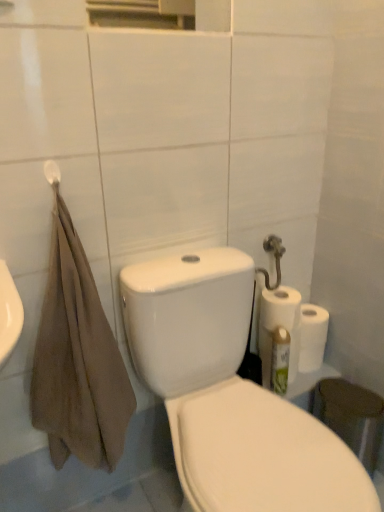
Question: Is white matte towel bar at upper left facing towards white glossy porcelain at center?

Choices:
 (A) no
 (B) yes

Answer: (A)

Question: Is white matte towel bar at upper left closer to the viewer compared to white glossy porcelain at center?

Choices:
 (A) yes
 (B) no

Answer: (B)

Question: Considering the relative positions of white matte towel bar at upper left and white glossy porcelain at center in the image provided, is white matte towel bar at upper left to the left of white glossy porcelain at center from the viewer's perspective?

Choices:
 (A) no
 (B) yes

Answer: (B)

Question: From a real-world perspective, is white matte towel bar at upper left over white glossy porcelain at center?

Choices:
 (A) yes
 (B) no

Answer: (A)

Question: Considering the relative sizes of white matte towel bar at upper left and white glossy porcelain at center in the image provided, is white matte towel bar at upper left smaller than white glossy porcelain at center?

Choices:
 (A) yes
 (B) no

Answer: (A)

Question: Could white glossy porcelain at center be considered to be inside white matte towel bar at upper left?

Choices:
 (A) yes
 (B) no

Answer: (B)

Question: Does white glossy porcelain at center appear on the left side of green matte cleaning product at right?

Choices:
 (A) yes
 (B) no

Answer: (A)

Question: Does white glossy porcelain at center have a lesser height compared to green matte cleaning product at right?

Choices:
 (A) no
 (B) yes

Answer: (A)

Question: Can you confirm if white glossy porcelain at center is positioned to the right of green matte cleaning product at right?

Choices:
 (A) no
 (B) yes

Answer: (A)

Question: Can you confirm if white glossy porcelain at center is thinner than green matte cleaning product at right?

Choices:
 (A) yes
 (B) no

Answer: (B)

Question: Is white glossy porcelain at center facing towards green matte cleaning product at right?

Choices:
 (A) no
 (B) yes

Answer: (A)

Question: Does white glossy porcelain at center lie in front of green matte cleaning product at right?

Choices:
 (A) no
 (B) yes

Answer: (B)

Question: Considering the relative sizes of white matte towel bar at upper left and white matte paper towel at right in the image provided, is white matte towel bar at upper left shorter than white matte paper towel at right?

Choices:
 (A) yes
 (B) no

Answer: (A)